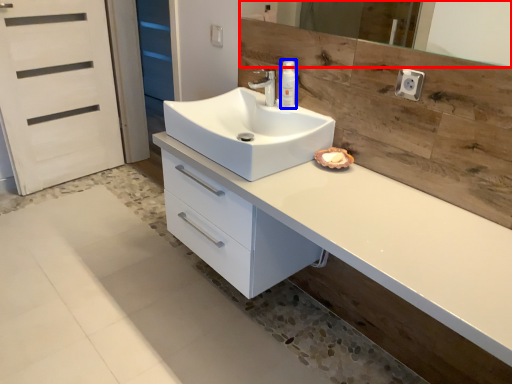
Question: Which object is closer to the camera taking this photo, mirror (highlighted by a red box) or soap dispenser (highlighted by a blue box)?

Choices:
 (A) mirror
 (B) soap dispenser

Answer: (A)